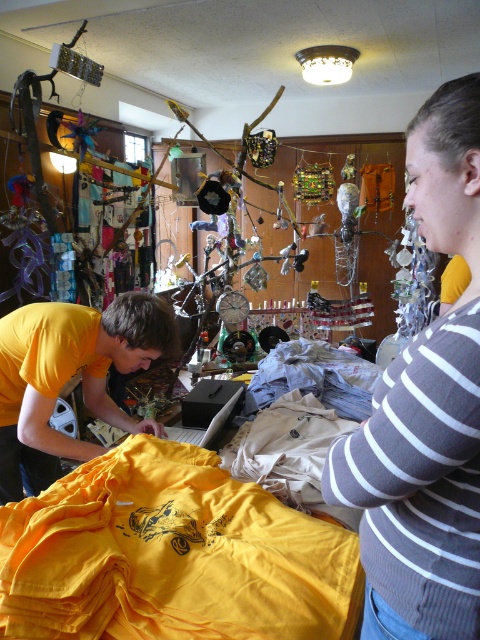
Which is in front, point (262, 486) or point (403, 632)?

Positioned in front is point (403, 632).

This screenshot has height=640, width=480. In order to click on yellow matte t-shirt at lower left in this screenshot , I will do `click(171, 556)`.

Does point (170, 490) lie behind point (103, 321)?

No, it is not.

Which is in front, point (322, 556) or point (84, 460)?

Point (322, 556) is more forward.

Is point (123, 545) closer to camera compared to point (108, 394)?

Yes, it is.

Where is `yellow matte t-shirt at lower left`? The height and width of the screenshot is (640, 480). yellow matte t-shirt at lower left is located at coordinates (171, 556).

Between gray striped sweater at upper right and yellow matte shirt at left, which one is positioned lower?

yellow matte shirt at left is lower down.

Describe the element at coordinates (425, 410) in the screenshot. This screenshot has width=480, height=640. I see `gray striped sweater at upper right` at that location.

Locate an element on the screen. The width and height of the screenshot is (480, 640). gray striped sweater at upper right is located at coordinates (425, 410).